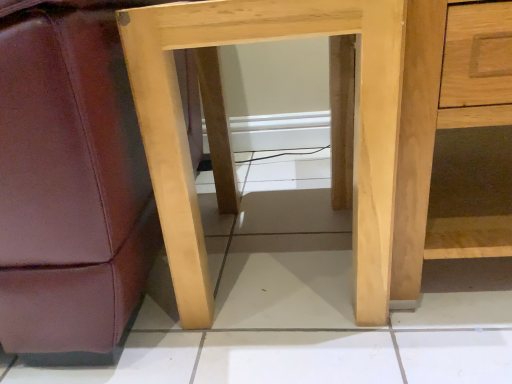
The width and height of the screenshot is (512, 384). Describe the element at coordinates (356, 130) in the screenshot. I see `natural wood table at center` at that location.

Measure the distance between point (493, 181) and camera.

Point (493, 181) and camera are 33.31 inches apart.

What is the approximate height of natural wood table at center?

natural wood table at center is 20.08 inches in height.

The image size is (512, 384). Find the location of `natural wood table at center`. natural wood table at center is located at coordinates (356, 130).

This screenshot has height=384, width=512. In order to click on natural wood table at center in this screenshot , I will do `click(356, 130)`.